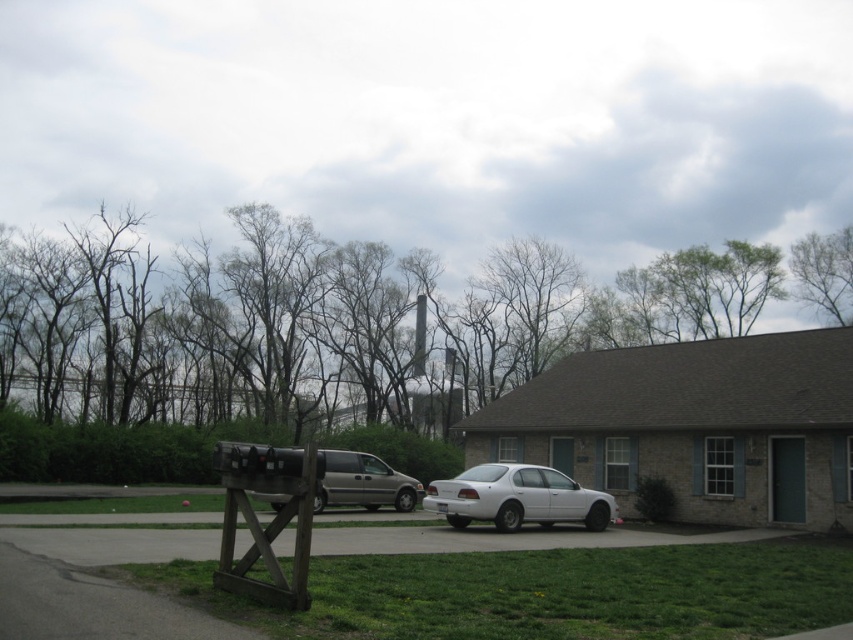
Is point (419, 536) behind point (532, 497)?

No, it is not.

Is gray concrete driveway at lower center above white matte sedan at center?

Indeed, gray concrete driveway at lower center is positioned over white matte sedan at center.

This screenshot has width=853, height=640. Identify the location of gray concrete driveway at lower center. (506, 538).

Which of these two, white matte sedan at center or metallic silver van at center, stands taller?

With more height is metallic silver van at center.

Between white matte sedan at center and metallic silver van at center, which one appears on the left side from the viewer's perspective?

From the viewer's perspective, metallic silver van at center appears more on the left side.

Where is `white matte sedan at center`? This screenshot has height=640, width=853. white matte sedan at center is located at coordinates (517, 497).

Where is `white matte sedan at center`? The width and height of the screenshot is (853, 640). white matte sedan at center is located at coordinates (517, 497).

Can you confirm if gray concrete driveway at lower center is positioned to the left of metallic silver van at center?

No, gray concrete driveway at lower center is not to the left of metallic silver van at center.

Who is more forward, (281, 544) or (350, 486)?

Point (281, 544) is more forward.

Between point (485, 536) and point (328, 493), which one is positioned in front?

Point (485, 536)

At what (x,y) coordinates should I click in order to perform the action: click on gray concrete driveway at lower center. Please return your answer as a coordinate pair (x, y). Looking at the image, I should click on (506, 538).